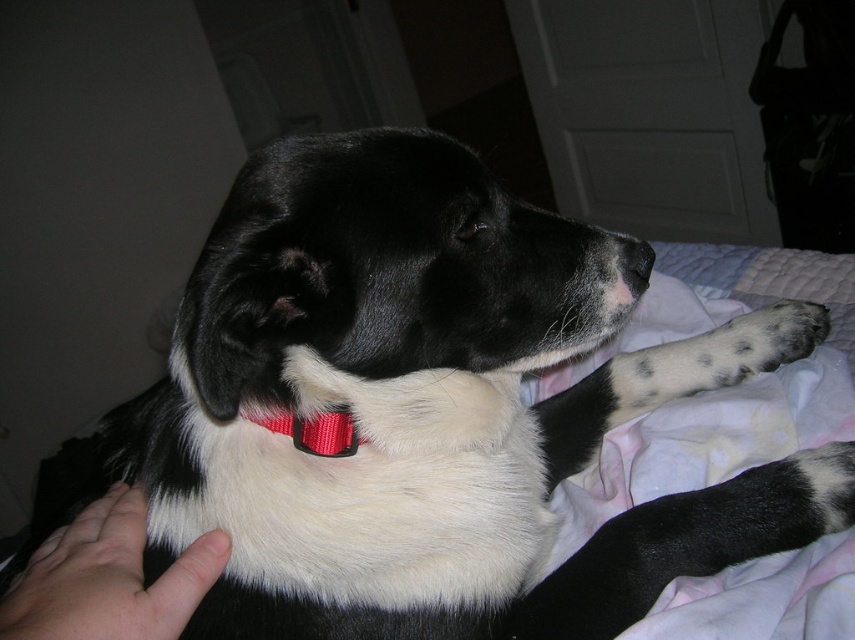
Question: Which point is closer to the camera?

Choices:
 (A) (3, 634)
 (B) (345, 420)

Answer: (A)

Question: Does red nylon collar at center appear on the right side of black matte nose at center?

Choices:
 (A) no
 (B) yes

Answer: (A)

Question: Which is nearer to the black matte nose at center?

Choices:
 (A) red nylon collar at center
 (B) soft skin hand at lower left

Answer: (A)

Question: Can you confirm if red nylon collar at center is positioned above black matte nose at center?

Choices:
 (A) no
 (B) yes

Answer: (A)

Question: Which point is farther to the camera?

Choices:
 (A) (81, 636)
 (B) (628, 266)
 (C) (333, 449)

Answer: (B)

Question: Does red nylon collar at center appear on the right side of black matte nose at center?

Choices:
 (A) no
 (B) yes

Answer: (A)